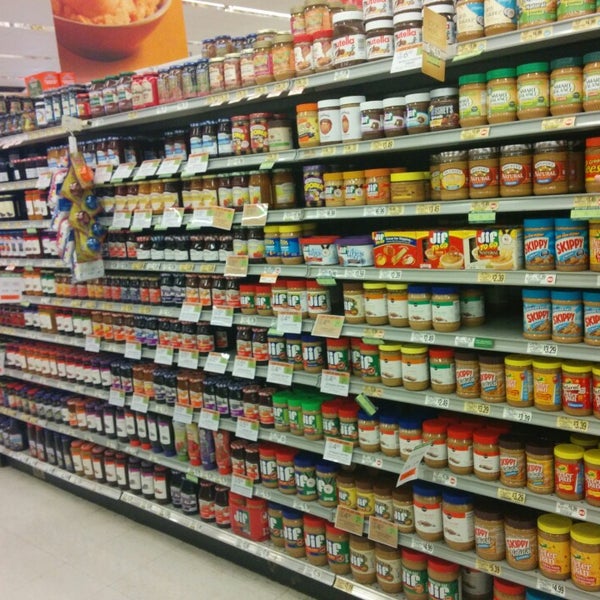
The image size is (600, 600). In order to click on shelf in this screenshot , I will do `click(530, 500)`, `click(518, 568)`, `click(354, 585)`, `click(538, 348)`, `click(537, 418)`, `click(520, 43)`, `click(552, 130)`.